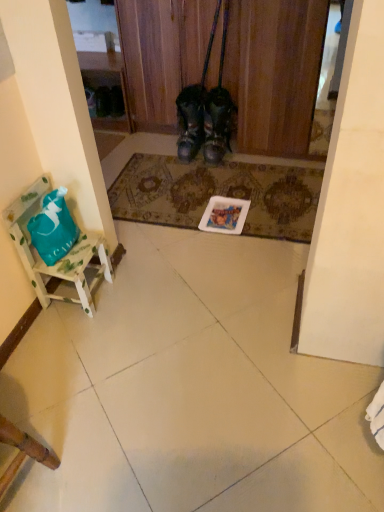
Locate an element on the screen. The height and width of the screenshot is (512, 384). vacant area that is in front of black leather boots at center is located at coordinates (186, 167).